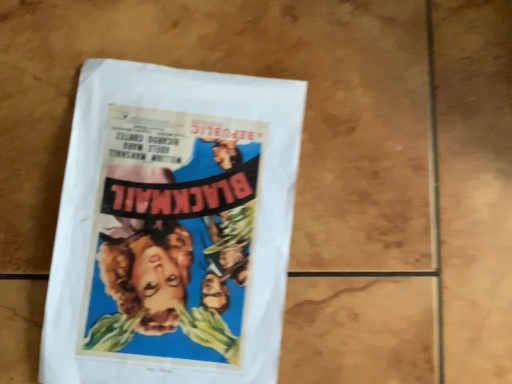
In order to face matte paper poster at center, should I rotate leftwards or rightwards?

It's best to rotate left around 10.651 degrees.

Where is `matte paper poster at center`? This screenshot has height=384, width=512. matte paper poster at center is located at coordinates (173, 227).

Describe the element at coordinates (173, 227) in the screenshot. The width and height of the screenshot is (512, 384). I see `matte paper poster at center` at that location.

Where is `matte paper poster at center`? matte paper poster at center is located at coordinates (173, 227).